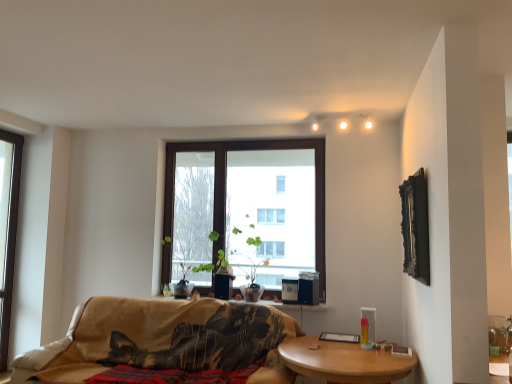
Describe the element at coordinates (172, 375) in the screenshot. I see `velvet black blanket at center` at that location.

Identify the location of brown wooden window at center, the second window when ordered from left to right. The width and height of the screenshot is (512, 384). (245, 211).

What is the approximate height of matte white light bulb at upper center?

matte white light bulb at upper center is 4.67 inches in height.

In order to click on matte white light bulb at upper center in this screenshot , I will do `click(343, 125)`.

What do you see at coordinates (8, 229) in the screenshot? I see `clear glass window at left, marked as the second window in a right-to-left arrangement` at bounding box center [8, 229].

Find the location of `velvet black blanket at center`. velvet black blanket at center is located at coordinates (172, 375).

Is brown wooden window at center, which is the first window from right to left, with black wood picture frame at upper right?

No, brown wooden window at center, which is the first window from right to left, is not making contact with black wood picture frame at upper right.

Consider the image. In the image, is brown wooden window at center, the second window when ordered from left to right, on the left side or the right side of black wood picture frame at upper right?

Clearly, brown wooden window at center, the second window when ordered from left to right, is on the left of black wood picture frame at upper right in the image.

Does point (169, 238) come in front of point (406, 206)?

No, it is not.

I want to click on coffee table located on the right of clear glass window at left, which is the first window in left-to-right order, so click(x=343, y=361).

Could you tell me if clear glass window at left, marked as the second window in a right-to-left arrangement, is turned towards wooden at lower right?

Yes.

Between clear glass window at left, marked as the second window in a right-to-left arrangement, and wooden at lower right, which one has more height?

With more height is clear glass window at left, marked as the second window in a right-to-left arrangement.

From the picture: Considering the sizes of objects black wood picture frame at upper right and wooden at lower right in the image provided, who is thinner, black wood picture frame at upper right or wooden at lower right?

Thinner between the two is black wood picture frame at upper right.

Is black wood picture frame at upper right inside the boundaries of wooden at lower right, or outside?

black wood picture frame at upper right is not enclosed by wooden at lower right.

Looking at this image, which object is closer to the camera, black wood picture frame at upper right or wooden at lower right?

wooden at lower right.

Considering the relative sizes of black wood picture frame at upper right and wooden at lower right in the image provided, is black wood picture frame at upper right shorter than wooden at lower right?

No, black wood picture frame at upper right is not shorter than wooden at lower right.

Looking at this image, from the image's perspective, which one is positioned higher, velvet black blanket at center or wooden at lower right?

velvet black blanket at center.

Which object is wider, velvet black blanket at center or wooden at lower right?

Wider between the two is wooden at lower right.

Is velvet black blanket at center spatially inside wooden at lower right, or outside of it?

velvet black blanket at center lies outside wooden at lower right.

Which is more to the right, black wood picture frame at upper right or green leafy plant at center?

Positioned to the right is black wood picture frame at upper right.

Is black wood picture frame at upper right completely or partially outside of green leafy plant at center?

black wood picture frame at upper right is positioned outside green leafy plant at center.

From the picture: Is black wood picture frame at upper right directly adjacent to green leafy plant at center?

black wood picture frame at upper right and green leafy plant at center are clearly separated.

From their relative heights in the image, would you say matte white light bulb at upper center is taller or shorter than wooden at lower right?

In the image, matte white light bulb at upper center appears to be shorter than wooden at lower right.

Consider the image. Can you tell me how much matte white light bulb at upper center and wooden at lower right differ in facing direction?

The angular difference between matte white light bulb at upper center and wooden at lower right is 0.595 degrees.

The height and width of the screenshot is (384, 512). Identify the location of light behind the wooden at lower right. (343, 125).

From a real-world perspective, is matte white light bulb at upper center positioned under wooden at lower right based on gravity?

No, from a real-world perspective, matte white light bulb at upper center is not beneath wooden at lower right.

Is beige fabric couch at center inside the boundaries of clear glass window at left, which is the first window in left-to-right order, or outside?

beige fabric couch at center is located beyond the bounds of clear glass window at left, which is the first window in left-to-right order.

How different are the orientations of beige fabric couch at center and clear glass window at left, which is the first window in left-to-right order, in degrees?

The facing directions of beige fabric couch at center and clear glass window at left, which is the first window in left-to-right order, are 89 degrees apart.

Can you confirm if beige fabric couch at center is taller than clear glass window at left, which is the first window in left-to-right order?

No.

In order to click on window lying on the left of beige fabric couch at center in this screenshot , I will do click(x=8, y=229).

Image resolution: width=512 pixels, height=384 pixels. I want to click on the 1st window to the left when counting from the black wood picture frame at upper right, so click(x=245, y=211).

Starting from the wooden at lower right, which window is the 1st one behind? Please provide its 2D coordinates.

[(8, 229)]

When comparing their distances from brown wooden window at center, which is the first window from right to left, does green leafy plant at center or clear glass window at left, marked as the second window in a right-to-left arrangement, seem further?

clear glass window at left, marked as the second window in a right-to-left arrangement, is further to brown wooden window at center, which is the first window from right to left.

Looking at this image, when comparing their distances from beige fabric couch at center, does black wood picture frame at upper right or matte white light bulb at upper center seem further?

matte white light bulb at upper center is positioned further to the anchor beige fabric couch at center.

Estimate the real-world distances between objects in this image. Which object is closer to clear glass window at left, which is the first window in left-to-right order, green leafy plant at center or brown wooden window at center, which is the first window from right to left?

green leafy plant at center is closer to clear glass window at left, which is the first window in left-to-right order.

Which object lies further to the anchor point wooden at lower right, clear glass window at left, marked as the second window in a right-to-left arrangement, or black wood picture frame at upper right?

clear glass window at left, marked as the second window in a right-to-left arrangement, lies further to wooden at lower right than the other object.

From the image, which object appears to be farther from velvet black blanket at center, matte white light bulb at upper center or wooden at lower right?

matte white light bulb at upper center.

Which object lies further to the anchor point beige fabric couch at center, clear glass window at left, marked as the second window in a right-to-left arrangement, or wooden at lower right?

Among the two, clear glass window at left, marked as the second window in a right-to-left arrangement, is located further to beige fabric couch at center.

In the scene shown: Estimate the real-world distances between objects in this image. Which object is closer to wooden at lower right, brown wooden window at center, the second window when ordered from left to right, or black wood picture frame at upper right?

Based on the image, black wood picture frame at upper right appears to be nearer to wooden at lower right.

Based on the photo, when comparing their distances from wooden at lower right, does beige fabric couch at center or clear glass window at left, which is the first window in left-to-right order, seem further?

Among the two, clear glass window at left, which is the first window in left-to-right order, is located further to wooden at lower right.

This screenshot has height=384, width=512. What are the coordinates of `plant located between clear glass window at left, which is the first window in left-to-right order, and brown wooden window at center, which is the first window from right to left, in the left-right direction` in the screenshot? It's located at (211, 263).

This screenshot has height=384, width=512. In order to click on plant between beige fabric couch at center and black wood picture frame at upper right in the horizontal direction in this screenshot , I will do `click(211, 263)`.

Where is `blanket between clear glass window at left, which is the first window in left-to-right order, and black wood picture frame at upper right`? This screenshot has width=512, height=384. blanket between clear glass window at left, which is the first window in left-to-right order, and black wood picture frame at upper right is located at coordinates (172, 375).

Identify the location of plant located between velvet black blanket at center and black wood picture frame at upper right in the left-right direction. The image size is (512, 384). (211, 263).